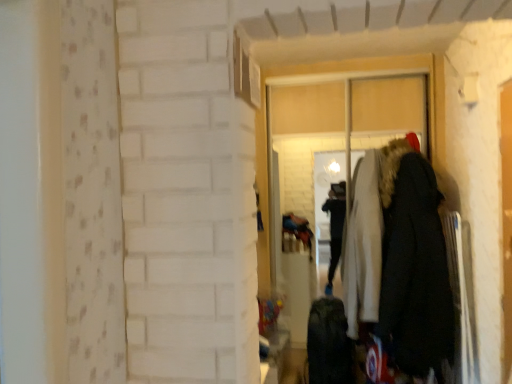
Describe the element at coordinates (329, 343) in the screenshot. I see `black fabric suitcase at lower center` at that location.

Identify the location of black fabric suitcase at lower center. The height and width of the screenshot is (384, 512). (329, 343).

The image size is (512, 384). Find the location of `black fabric suitcase at lower center`. black fabric suitcase at lower center is located at coordinates (329, 343).